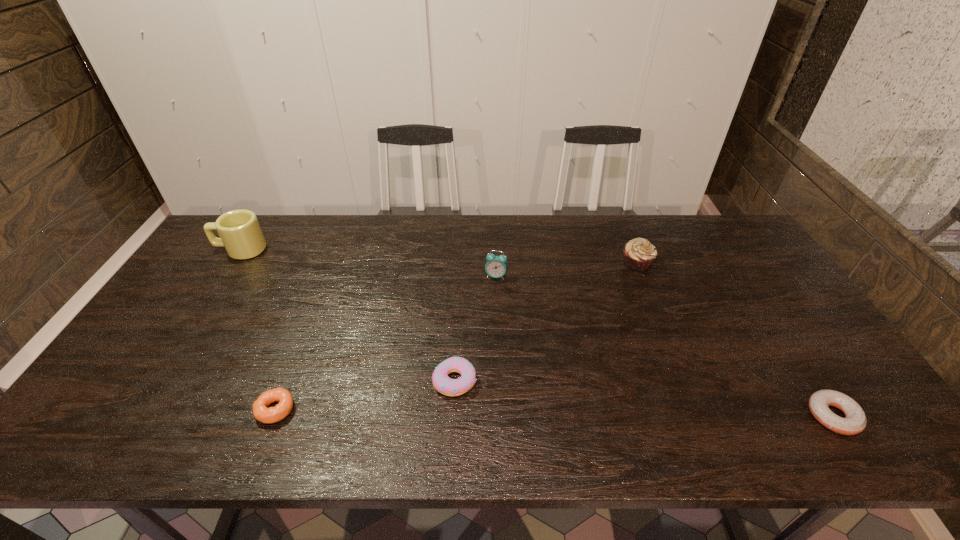
Image resolution: width=960 pixels, height=540 pixels. What are the coordinates of `free spot between the second object from right to left and the leftmost doughnut` in the screenshot? It's located at (456, 336).

The image size is (960, 540). What are the coordinates of `free space between the muffin and the fourth object from left to right` in the screenshot? It's located at (566, 269).

Locate an element on the screen. The image size is (960, 540). vacant area between the second object from left to right and the alarm clock is located at coordinates (386, 342).

Select which object appears as the fourth closest to the fourth object from left to right. Please provide its 2D coordinates. Your answer should be formatted as a tuple, i.e. [(x, y)], where the tuple contains the x and y coordinates of a point satisfying the conditions above.

[(240, 233)]

Select which object appears as the fifth closest to the rightmost doughnut. Please provide its 2D coordinates. Your answer should be formatted as a tuple, i.e. [(x, y)], where the tuple contains the x and y coordinates of a point satisfying the conditions above.

[(240, 233)]

Choose which doughnut is the nearest neighbor to the rightmost doughnut. Please provide its 2D coordinates. Your answer should be formatted as a tuple, i.e. [(x, y)], where the tuple contains the x and y coordinates of a point satisfying the conditions above.

[(442, 383)]

Identify the location of the closest doughnut to the leftmost object. Image resolution: width=960 pixels, height=540 pixels. (261, 412).

Identify the location of free location that satisfies the following two spatial constraints: 1. with the handle on the side of the leftmost doughnut; 2. on the right side of the tallest object. (136, 409).

I want to click on vacant position in the image that satisfies the following two spatial constraints: 1. with the handle on the side of the fourth object from right to left; 2. on the right side of the tallest object, so click(x=156, y=381).

Locate an element on the screen. vacant space that satisfies the following two spatial constraints: 1. with the handle on the side of the tallest object; 2. on the back side of the rightmost doughnut is located at coordinates (132, 416).